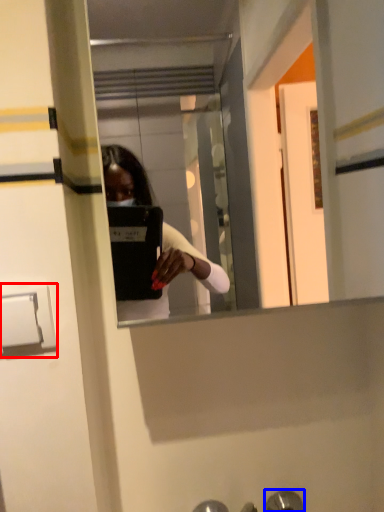
Question: Which of the following is the closest to the observer, door handle (highlighted by a red box) or door handle (highlighted by a blue box)?

Choices:
 (A) door handle
 (B) door handle

Answer: (A)